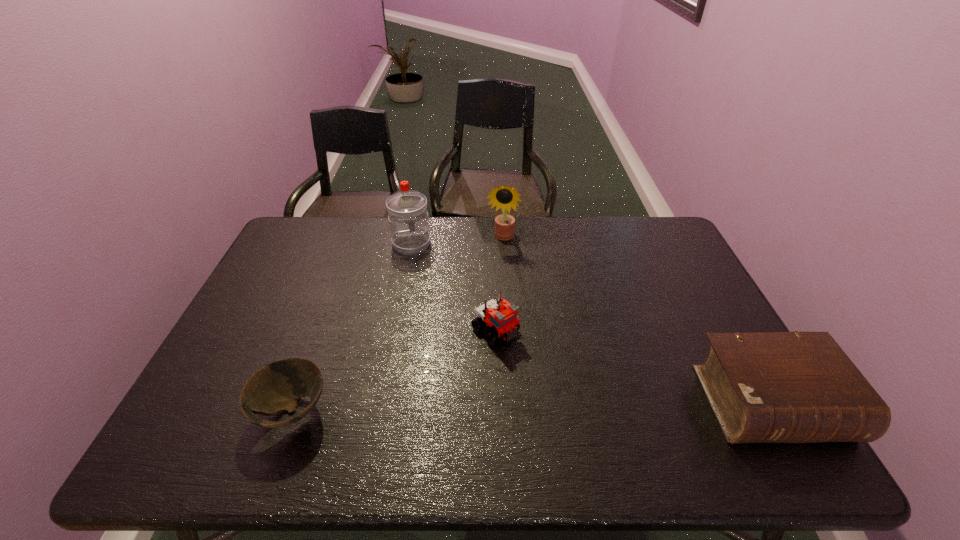
Choose which object is the fourth nearest neighbor to the bowl. Please provide its 2D coordinates. Your answer should be formatted as a tuple, i.e. [(x, y)], where the tuple contains the x and y coordinates of a point satisfying the conditions above.

[(764, 387)]

Select which object appears as the second closest to the Bible. Please provide its 2D coordinates. Your answer should be formatted as a tuple, i.e. [(x, y)], where the tuple contains the x and y coordinates of a point satisfying the conditions above.

[(504, 197)]

The width and height of the screenshot is (960, 540). Identify the location of free spot that satisfies the following two spatial constraints: 1. on the back side of the fourth object from right to left; 2. on the left side of the leftmost object. (353, 243).